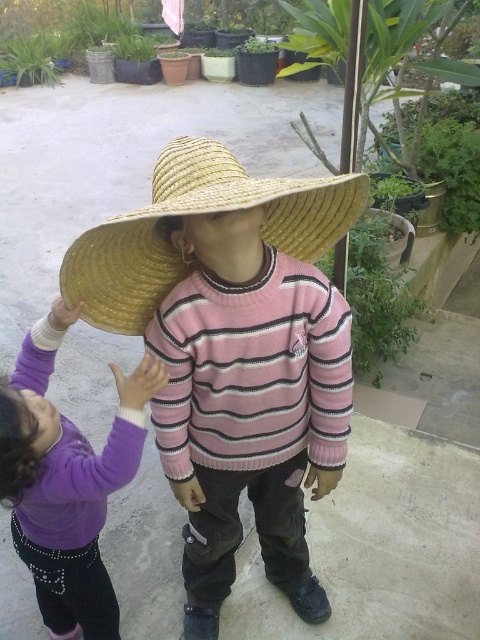
Question: Which point is farther to the camera?

Choices:
 (A) straw hat at center
 (B) purple fleece sweater at center

Answer: (B)

Question: Does purple fleece sweater at center appear over straw hat at center?

Choices:
 (A) yes
 (B) no

Answer: (B)

Question: Which of the following is the farthest from the observer?

Choices:
 (A) (119, 467)
 (B) (211, 212)

Answer: (A)

Question: Is purple fleece sweater at center to the left of straw hat at center from the viewer's perspective?

Choices:
 (A) yes
 (B) no

Answer: (A)

Question: Is purple fleece sweater at center further to camera compared to straw hat at center?

Choices:
 (A) yes
 (B) no

Answer: (A)